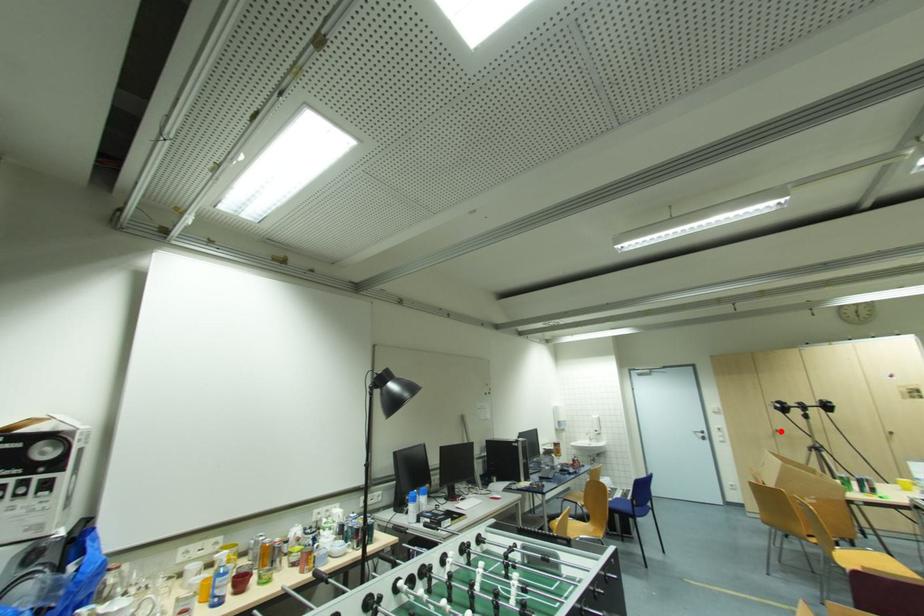
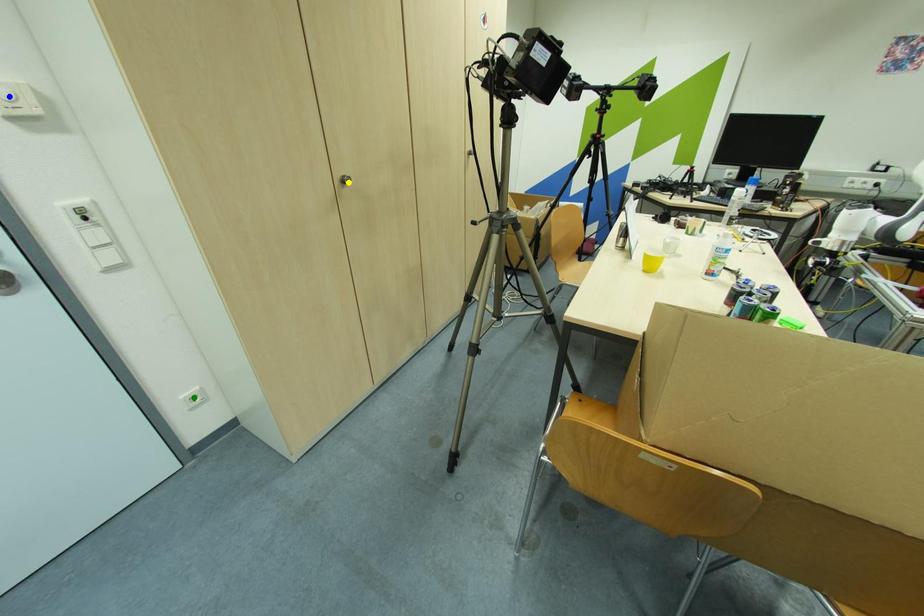
Question: I am providing you with two images of the same scene from different viewpoints. A red point is marked on the first image. You are given multiple points on the second image. Can you choose the point in image 2 that corresponds to the point in image 1?

Choices:
 (A) green point
 (B) yellow point
 (C) blue point

Answer: (B)